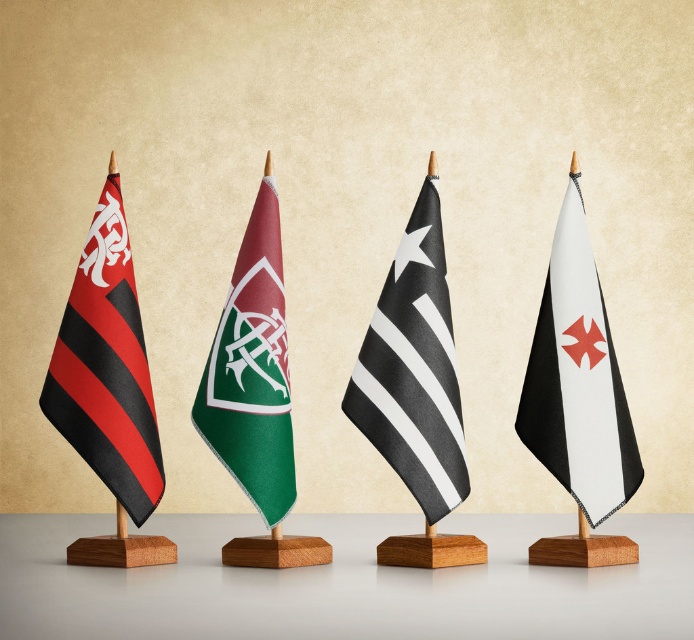
Who is taller, matte black and red striped flag at left or green fabric flag at center?

matte black and red striped flag at left is taller.

Does matte black and red striped flag at left have a greater width compared to green fabric flag at center?

Indeed, matte black and red striped flag at left has a greater width compared to green fabric flag at center.

Is point (90, 420) closer to camera compared to point (244, 413)?

No.

Identify the location of matte black and red striped flag at left. (105, 365).

Does black/white striped flag at center appear over black matte flag at right?

Correct, black/white striped flag at center is located above black matte flag at right.

Looking at this image, does black/white striped flag at center have a lesser height compared to black matte flag at right?

No.

The image size is (694, 640). Find the location of `black/white striped flag at center`. black/white striped flag at center is located at coordinates (414, 369).

Locate an element on the screen. Image resolution: width=694 pixels, height=640 pixels. black/white striped flag at center is located at coordinates (414, 369).

Can you confirm if black matte flag at right is positioned to the left of matte black and red striped flag at left?

Incorrect, black matte flag at right is not on the left side of matte black and red striped flag at left.

Is point (579, 406) positioned before point (124, 262)?

Yes, it is in front of point (124, 262).

Which is in front, point (561, 445) or point (71, 353)?

Point (561, 445) is in front.

What are the coordinates of `black matte flag at right` in the screenshot? It's located at (577, 378).